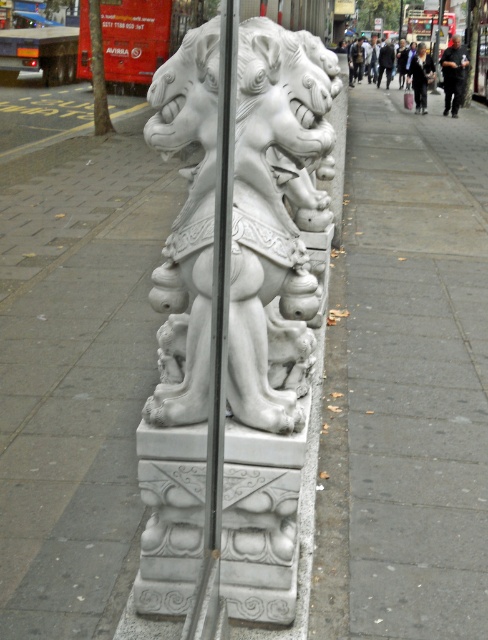
Question: Which object appears farthest from the camera in this image?

Choices:
 (A) gray concrete pavement at center
 (B) white stone lion at center

Answer: (A)

Question: Does gray concrete pavement at center appear on the right side of white stone lion at center?

Choices:
 (A) no
 (B) yes

Answer: (B)

Question: Which point is closer to the camera?

Choices:
 (A) (434, 300)
 (B) (304, 138)

Answer: (B)

Question: Observing the image, what is the correct spatial positioning of gray concrete pavement at center in reference to white stone lion at center?

Choices:
 (A) right
 (B) left

Answer: (A)

Question: Is the position of gray concrete pavement at center less distant than that of white stone lion at center?

Choices:
 (A) yes
 (B) no

Answer: (B)